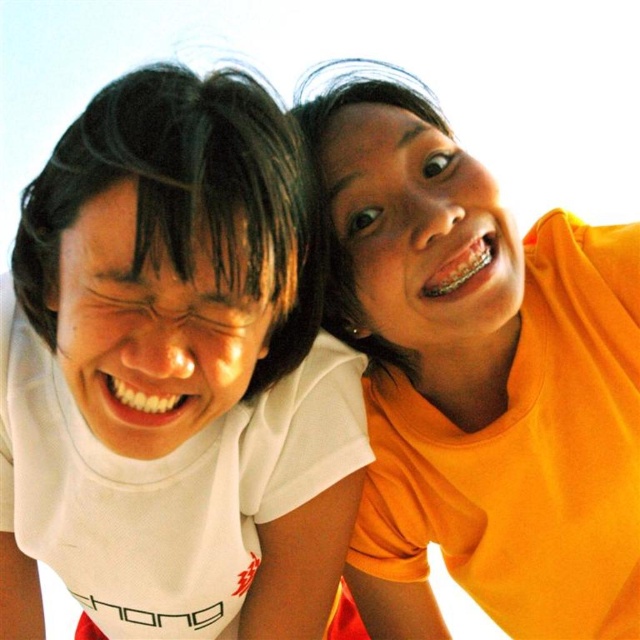
Which is more to the left, white matte t-shirt at upper left or orange matte shirt at upper right?

white matte t-shirt at upper left

Between white matte t-shirt at upper left and orange matte shirt at upper right, which one has more height?

Standing taller between the two is orange matte shirt at upper right.

Which is behind, point (186, 442) or point (413, 481)?

Positioned behind is point (413, 481).

You are a GUI agent. You are given a task and a screenshot of the screen. Output one action in this format:
    pyautogui.click(x=<x>, y=<y>)
    Task: Click on the white matte t-shirt at upper left
    The height and width of the screenshot is (640, 640).
    Given the screenshot: What is the action you would take?
    pyautogui.click(x=173, y=376)